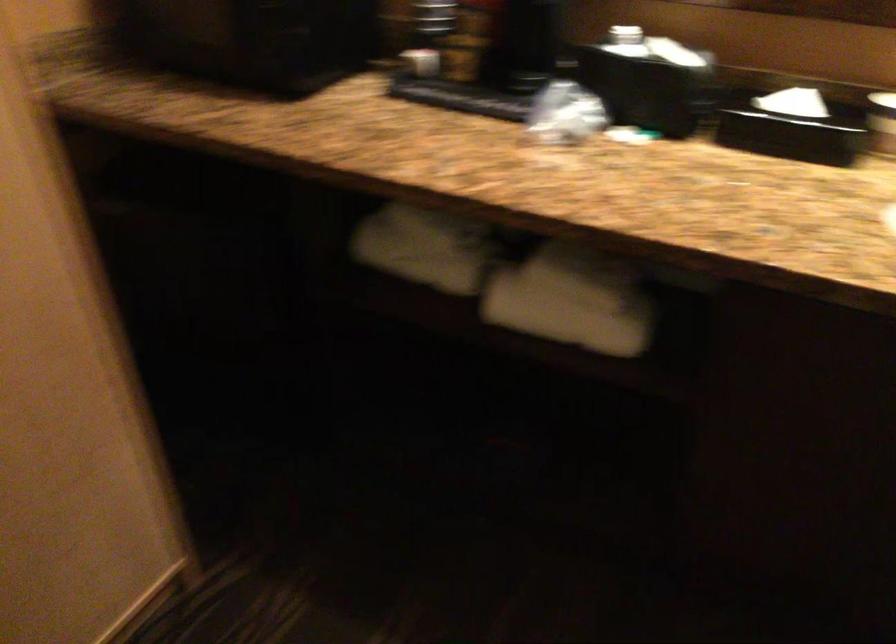
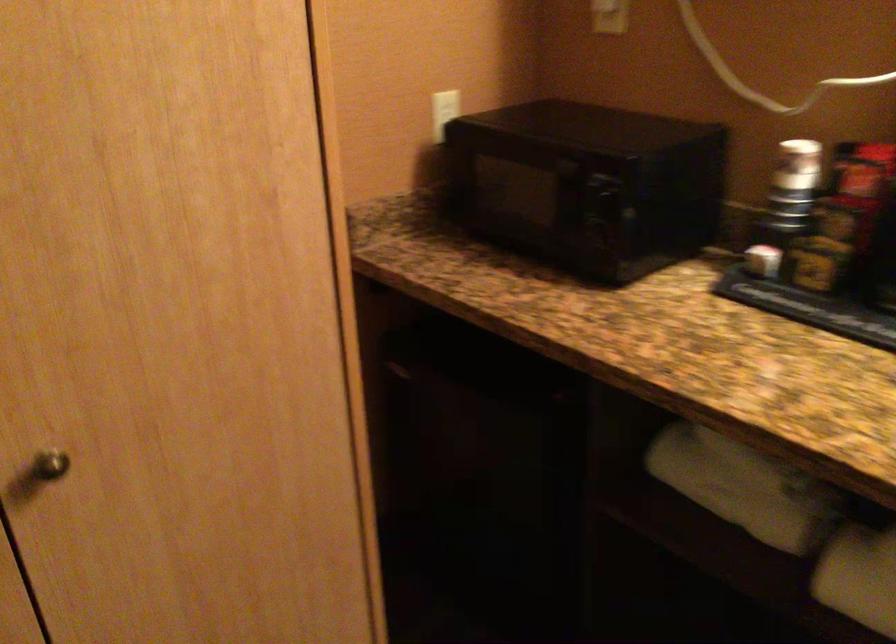
Question: The camera is either moving clockwise (left) or counter-clockwise (right) around the object. The first image is from the beginning of the video and the second image is from the end. Is the camera moving left or right when shooting the video?

Choices:
 (A) Left
 (B) Right

Answer: (B)